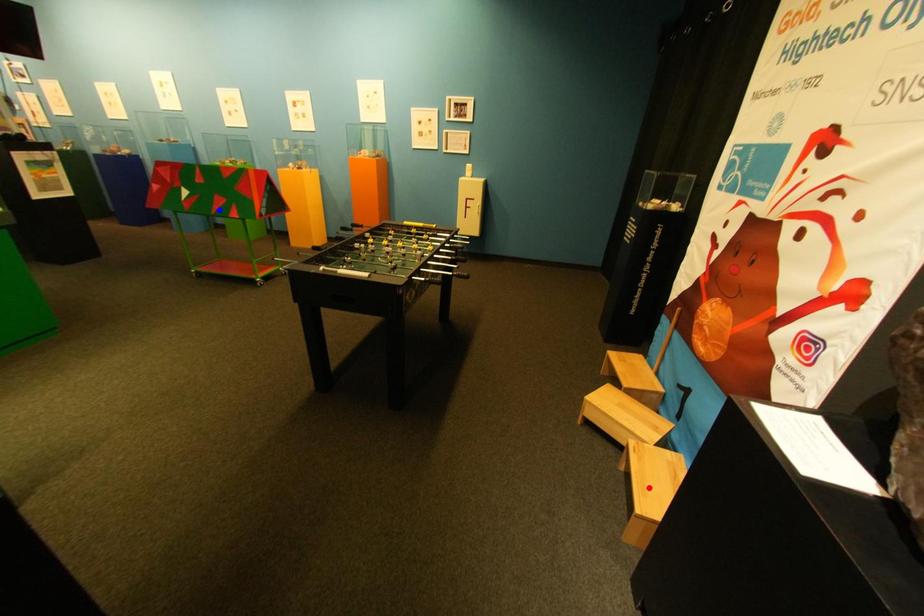
Question: In the image, two points are highlighted. Which point is nearer to the camera? Reply with the corresponding letter.

Choices:
 (A) blue point
 (B) red point

Answer: (B)